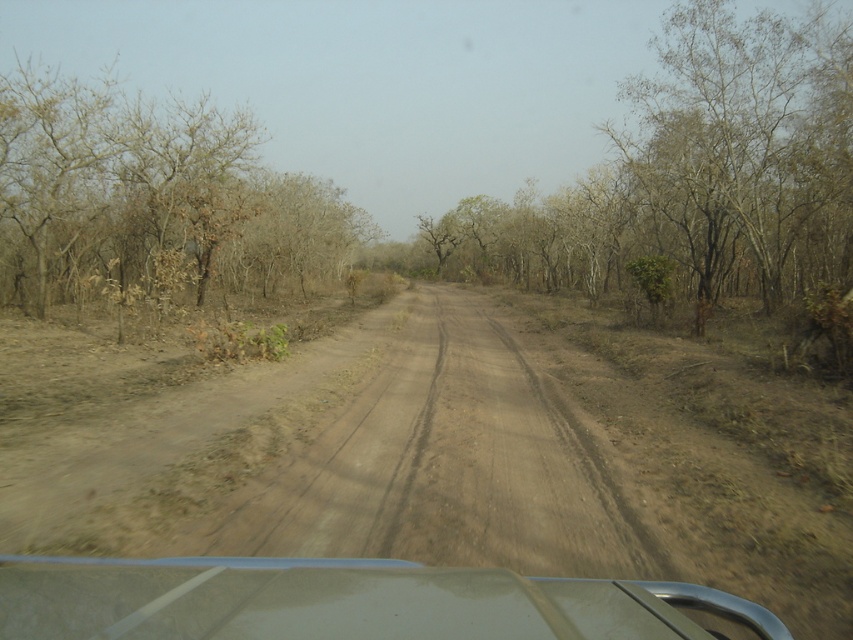
Is point (258, 524) less distant than point (102, 150)?

Yes, it is.

Locate an element on the screen. brown dirt track at center is located at coordinates (447, 467).

Is brown dry tree at left to the left of transparent plastic car window at center from the viewer's perspective?

Correct, you'll find brown dry tree at left to the left of transparent plastic car window at center.

Can you confirm if brown dry tree at left is bigger than transparent plastic car window at center?

Yes.

Locate an element on the screen. brown dry tree at left is located at coordinates (152, 202).

Where is `brown dry tree at left`? This screenshot has height=640, width=853. brown dry tree at left is located at coordinates (152, 202).

How distant is bare branches at center from transparent plastic car window at center?

bare branches at center is 24.54 meters from transparent plastic car window at center.

You are a GUI agent. You are given a task and a screenshot of the screen. Output one action in this format:
    pyautogui.click(x=<x>, y=<y>)
    Task: Click on the bare branches at center
    This screenshot has height=640, width=853.
    Given the screenshot: What is the action you would take?
    pyautogui.click(x=699, y=170)

The image size is (853, 640). What do you see at coordinates (699, 170) in the screenshot?
I see `bare branches at center` at bounding box center [699, 170].

Find the location of a particular element. bare branches at center is located at coordinates (699, 170).